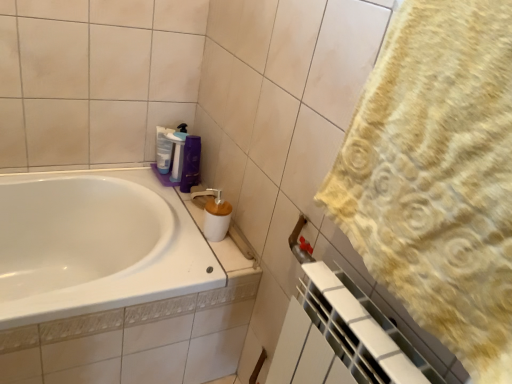
Question: Is translucent plastic bottle at upper center, the second cleaning product in the right-to-left sequence, positioned with its back to purple plastic bottle at upper center, which is counted as the 1th cleaning product, starting from the right?

Choices:
 (A) no
 (B) yes

Answer: (A)

Question: Is the position of translucent plastic bottle at upper center, the second cleaning product in the right-to-left sequence, less distant than that of purple plastic bottle at upper center, which ranks as the second cleaning product in left-to-right order?

Choices:
 (A) no
 (B) yes

Answer: (A)

Question: Would you say translucent plastic bottle at upper center, the second cleaning product in the right-to-left sequence, contains purple plastic bottle at upper center, which is counted as the 1th cleaning product, starting from the right?

Choices:
 (A) no
 (B) yes

Answer: (A)

Question: Is translucent plastic bottle at upper center, the second cleaning product in the right-to-left sequence, wider than purple plastic bottle at upper center, which ranks as the second cleaning product in left-to-right order?

Choices:
 (A) yes
 (B) no

Answer: (B)

Question: Is there a large distance between translucent plastic bottle at upper center, acting as the first cleaning product starting from the left, and purple plastic bottle at upper center, which is counted as the 1th cleaning product, starting from the right?

Choices:
 (A) no
 (B) yes

Answer: (A)

Question: Is purple glossy shampoo at upper center inside the boundaries of translucent plastic bottle at upper center, the second cleaning product in the right-to-left sequence, or outside?

Choices:
 (A) outside
 (B) inside

Answer: (A)

Question: Relative to translucent plastic bottle at upper center, the second cleaning product in the right-to-left sequence, is purple glossy shampoo at upper center in front or behind?

Choices:
 (A) behind
 (B) front

Answer: (B)

Question: Is purple glossy shampoo at upper center taller or shorter than translucent plastic bottle at upper center, the second cleaning product in the right-to-left sequence?

Choices:
 (A) tall
 (B) short

Answer: (A)

Question: Based on their sizes in the image, would you say purple glossy shampoo at upper center is bigger or smaller than translucent plastic bottle at upper center, acting as the first cleaning product starting from the left?

Choices:
 (A) big
 (B) small

Answer: (A)

Question: Is point (224, 208) closer or farther from the camera than point (169, 142)?

Choices:
 (A) farther
 (B) closer

Answer: (B)

Question: From the image's perspective, relative to translucent plastic bottle at upper center, acting as the first cleaning product starting from the left, is brown matte soap dispenser at center above or below?

Choices:
 (A) below
 (B) above

Answer: (A)

Question: Is brown matte soap dispenser at center in front of or behind translucent plastic bottle at upper center, the second cleaning product in the right-to-left sequence, in the image?

Choices:
 (A) front
 (B) behind

Answer: (A)

Question: Is brown matte soap dispenser at center inside or outside of translucent plastic bottle at upper center, the second cleaning product in the right-to-left sequence?

Choices:
 (A) outside
 (B) inside

Answer: (A)

Question: Is purple plastic bottle at upper center, which ranks as the second cleaning product in left-to-right order, inside or outside of yellow textured towel at right?

Choices:
 (A) outside
 (B) inside

Answer: (A)

Question: Based on their sizes in the image, would you say purple plastic bottle at upper center, which is counted as the 1th cleaning product, starting from the right, is bigger or smaller than yellow textured towel at right?

Choices:
 (A) big
 (B) small

Answer: (B)